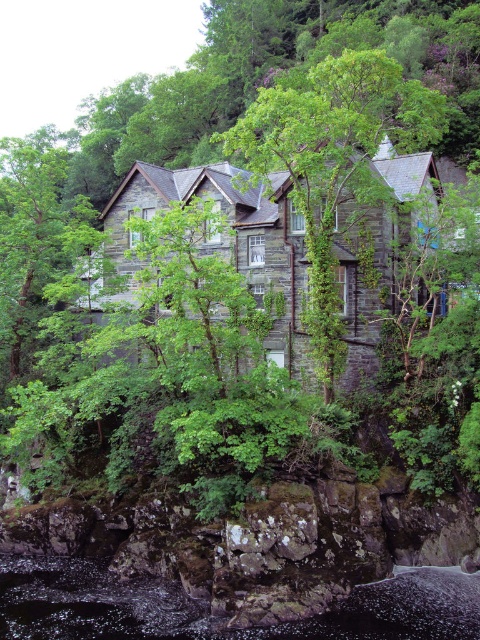
You are a landscape architect planning to install a walkway between the green leafy tree at center and the green leafy tree at left. What is the minimum length required for the walkway to connect both trees?

The minimum length required for the walkway to connect the green leafy tree at center and the green leafy tree at left is 15.43 meters, as this is the distance between them.

You are a visitor approaching the stone house and notice the green leafy tree at center and the black liquid at lower center. Which object is positioned to the right side from your viewpoint?

The green leafy tree at center is positioned to the right of the black liquid at lower center, so the green leafy tree at center is on the right side.